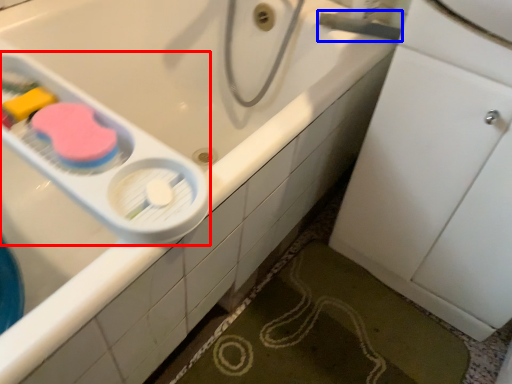
Question: Which point is closer to the camera, scale (highlighted by a red box) or plumbing fixture (highlighted by a blue box)?

Choices:
 (A) scale
 (B) plumbing fixture

Answer: (A)